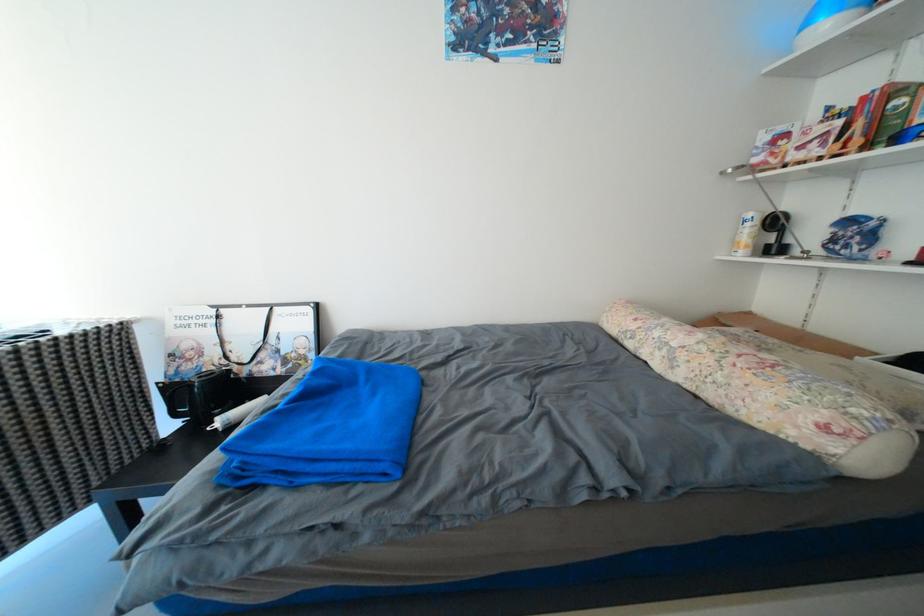
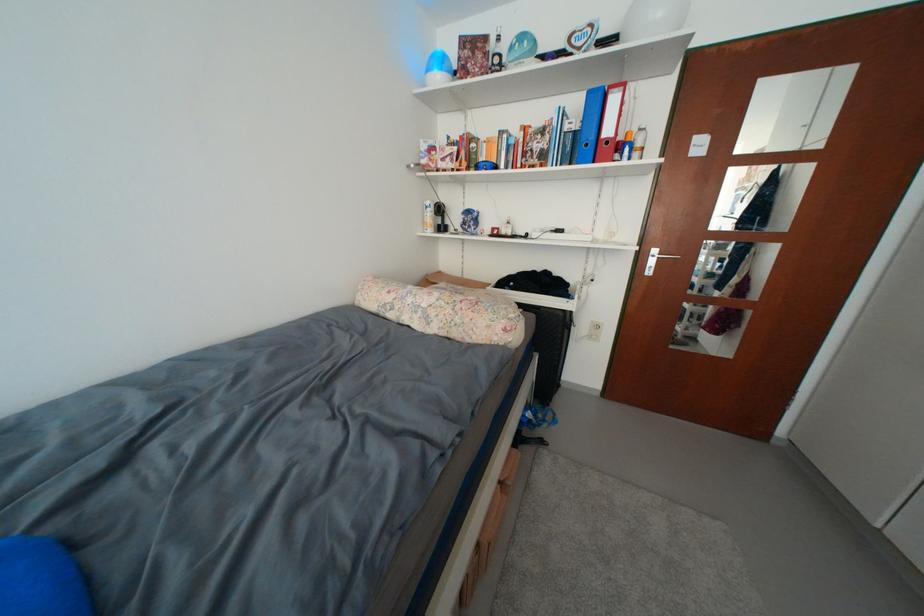
Where in the second image is the point corresponding to the point at 833,430 from the first image?

(514, 331)